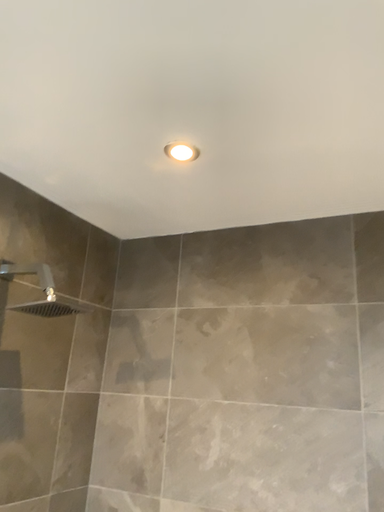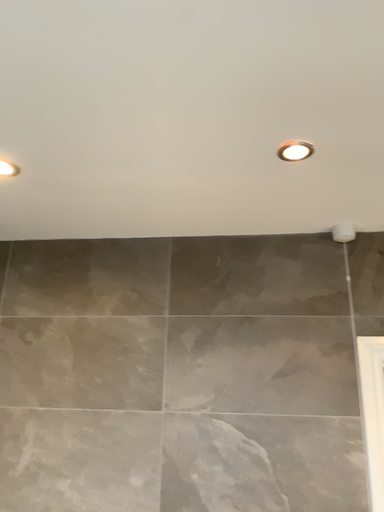
Question: Which way did the camera rotate in the video?

Choices:
 (A) rotated right
 (B) rotated left

Answer: (A)